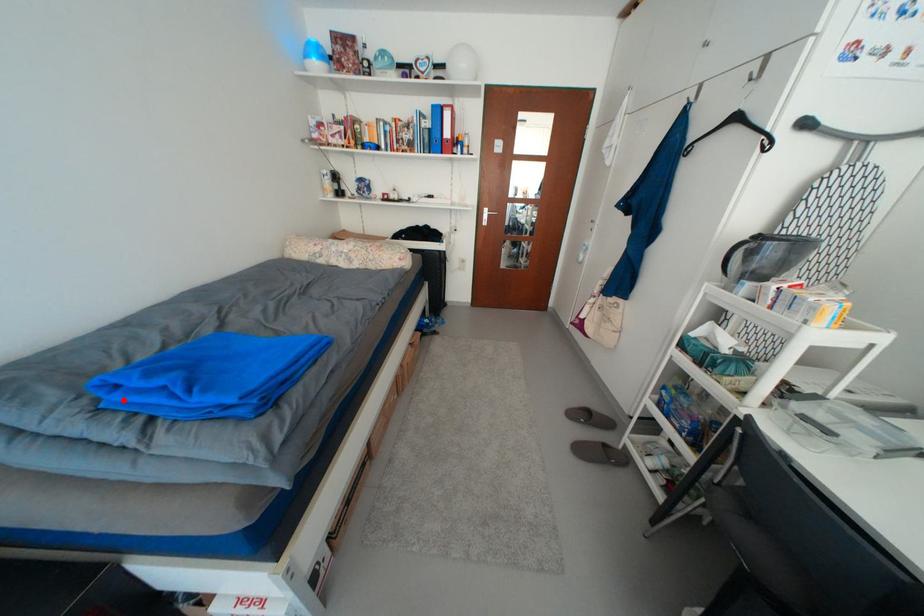
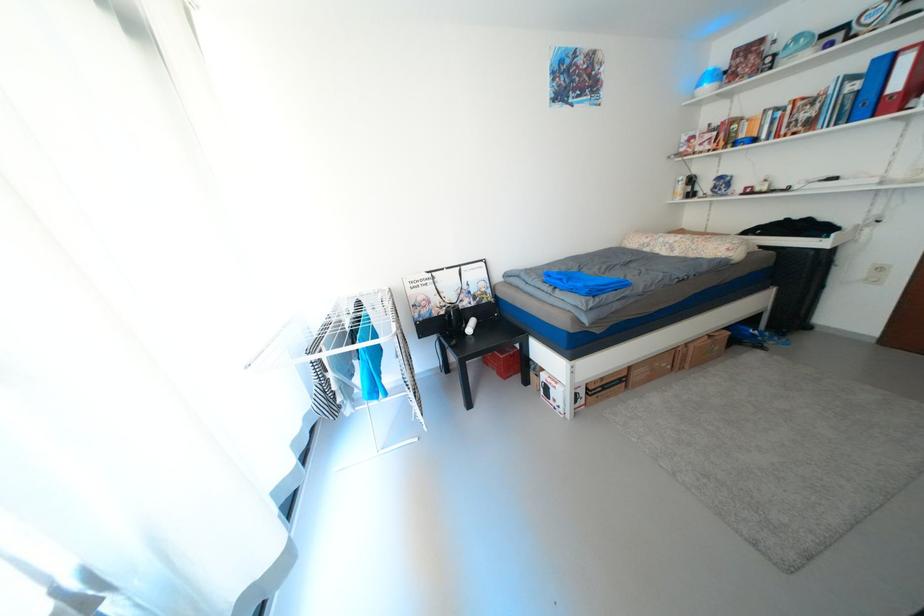
Where in the second image is the point corresponding to the highlighted location from the first image?

(556, 281)